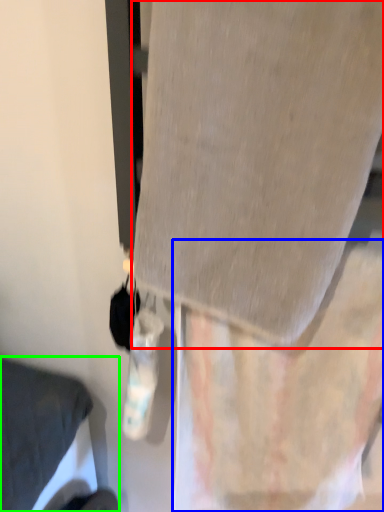
Question: Which object is the farthest from fabric (highlighted by a red box)? Choose among these: curtain (highlighted by a blue box) or furniture (highlighted by a green box).

Choices:
 (A) curtain
 (B) furniture

Answer: (B)